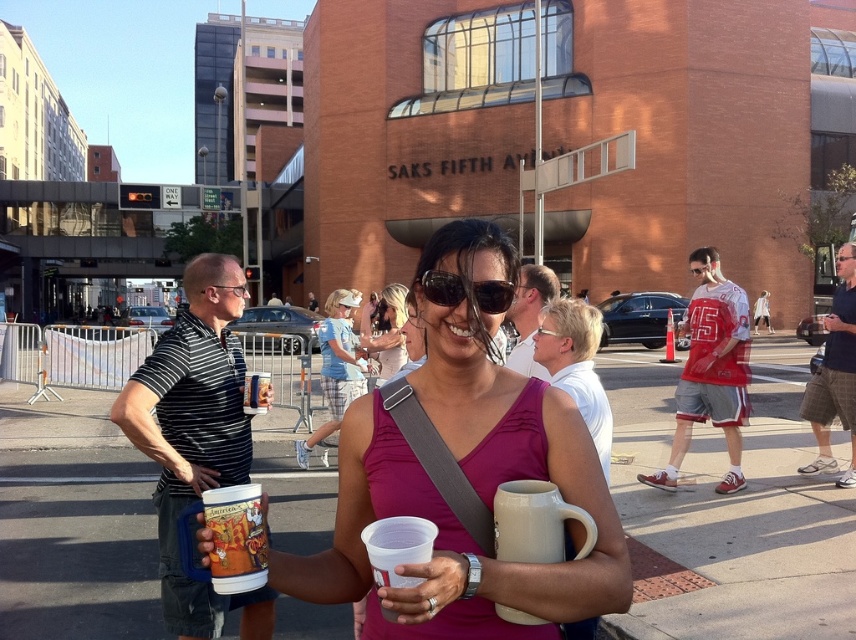
Question: Is white matte shirt at center thinner than translucent plastic cup at center?

Choices:
 (A) no
 (B) yes

Answer: (A)

Question: Among these points, which one is farthest from the camera?

Choices:
 (A) (527, 564)
 (B) (265, 381)
 (C) (339, 340)
 (D) (394, 300)

Answer: (C)

Question: Which point is farther to the camera?

Choices:
 (A) (598, 449)
 (B) (391, 284)

Answer: (B)

Question: Is white ceramic mug at center above white matte shirt at center?

Choices:
 (A) yes
 (B) no

Answer: (B)

Question: Among these objects, which one is farthest from the camera?

Choices:
 (A) translucent plastic cup at center
 (B) light blue denim shirt at center
 (C) pink matte tank top at center

Answer: (B)

Question: Can you confirm if pink matte tank top at center is positioned to the right of matte plastic mug at center?

Choices:
 (A) no
 (B) yes

Answer: (B)